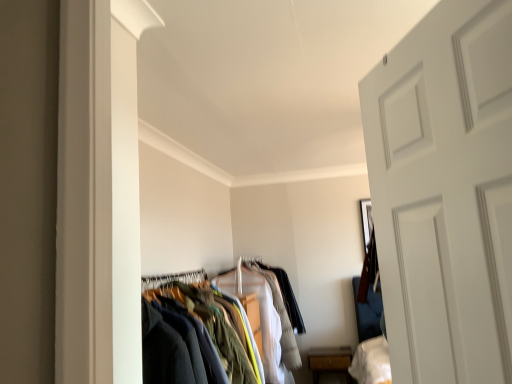
Question: Should I look upward or downward to see textured fabric clothes at center?

Choices:
 (A) up
 (B) down

Answer: (B)